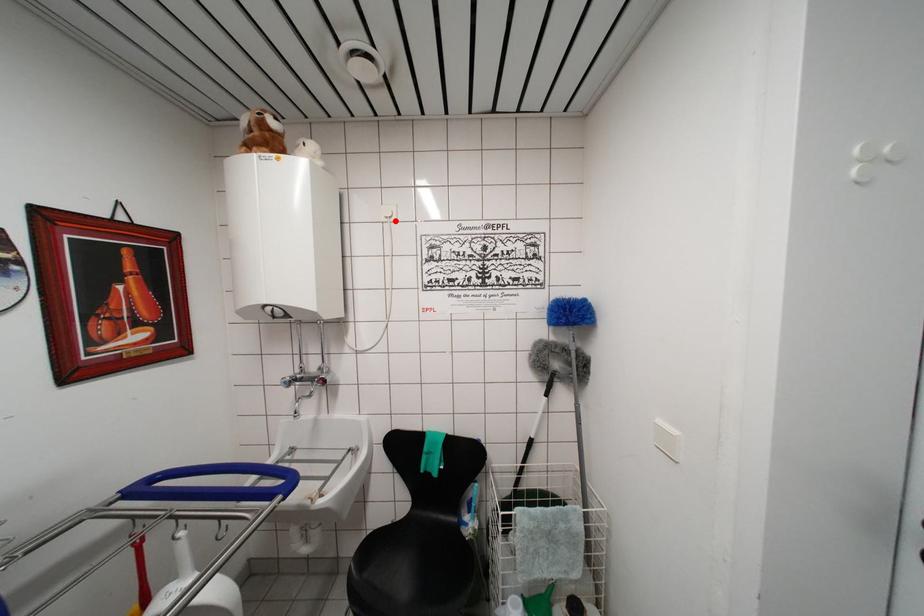
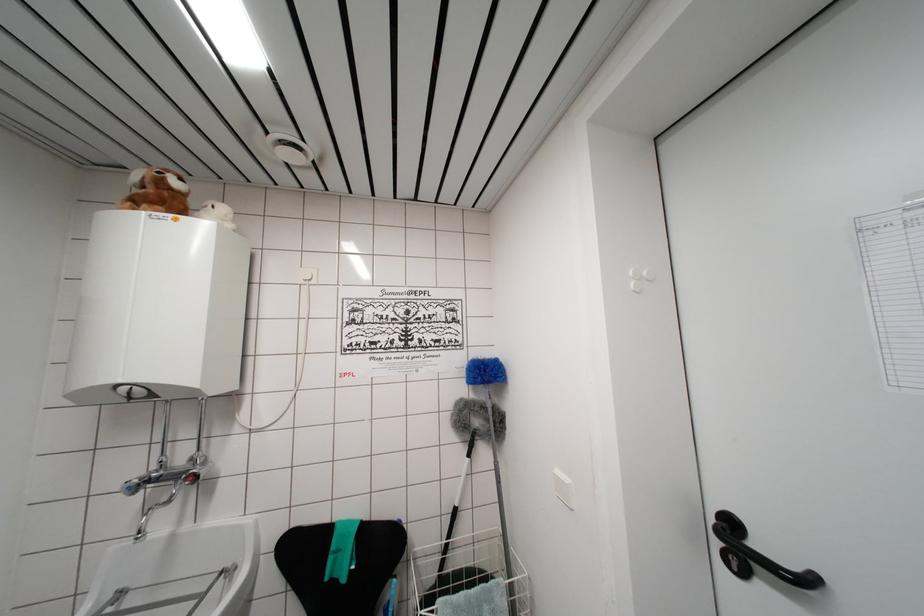
Find the pixel in the second image that matches the highlighted location in the first image.

(314, 284)